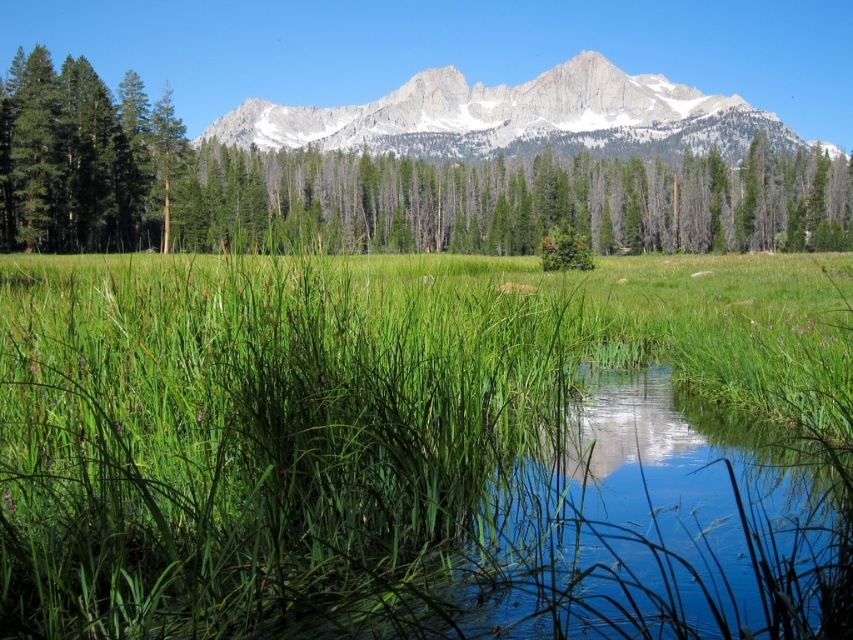
Who is higher up, green grassy at center or white rocky mountain range at upper center?

Positioned higher is white rocky mountain range at upper center.

How far apart are green grassy at center and white rocky mountain range at upper center?

green grassy at center is 193.33 meters from white rocky mountain range at upper center.

The width and height of the screenshot is (853, 640). Find the location of `green grassy at center`. green grassy at center is located at coordinates (422, 449).

Where is `green grassy at center`? The width and height of the screenshot is (853, 640). green grassy at center is located at coordinates (422, 449).

Which is below, green leafy tree at upper center or green matte tree at left?

green leafy tree at upper center is lower down.

The height and width of the screenshot is (640, 853). Find the location of `green leafy tree at upper center`. green leafy tree at upper center is located at coordinates (370, 188).

This screenshot has width=853, height=640. What are the coordinates of `green leafy tree at upper center` in the screenshot? It's located at (370, 188).

Does white rocky mountain range at upper center come behind green matte tree at left?

That is True.

Find the location of a particular element. white rocky mountain range at upper center is located at coordinates (514, 116).

Locate an element on the screen. white rocky mountain range at upper center is located at coordinates (514, 116).